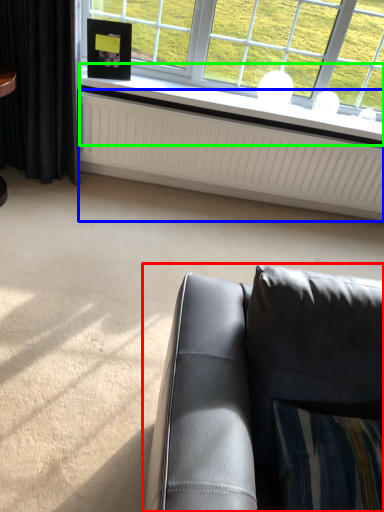
Question: Which object is the closest to the studio couch (highlighted by a red box)? Choose among these: radiator (highlighted by a blue box) or window sill (highlighted by a green box).

Choices:
 (A) radiator
 (B) window sill

Answer: (A)